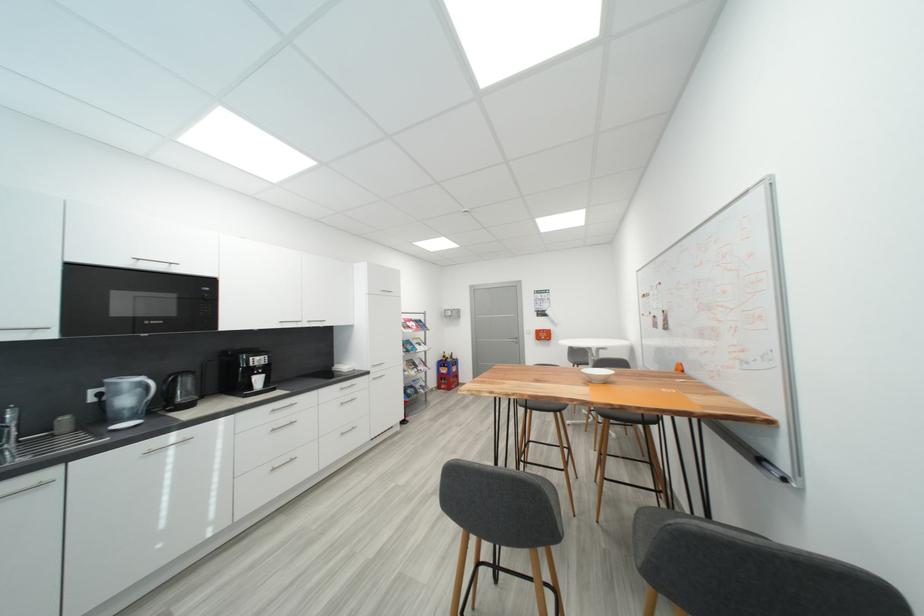
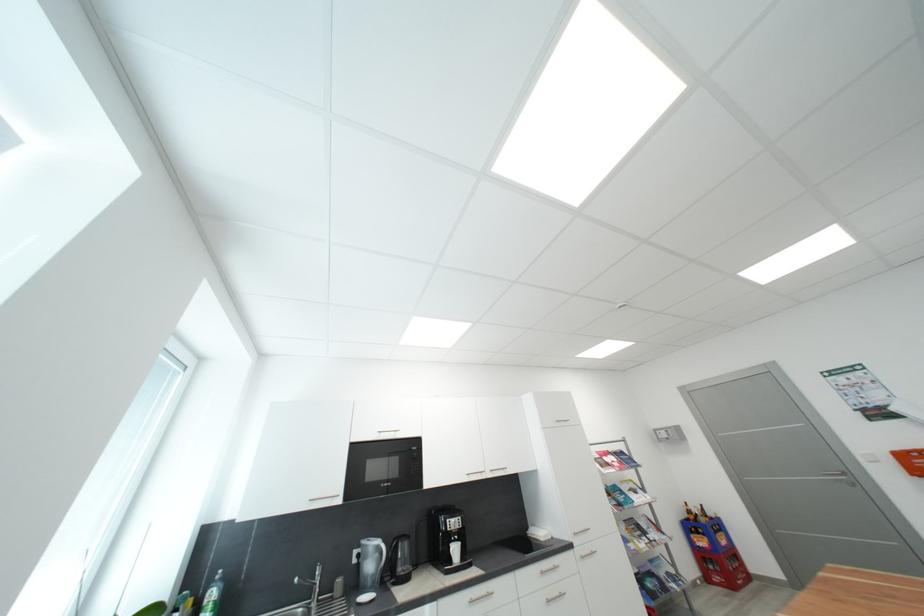
In the second image, find the point that corresponds to pixel 265 382 in the first image.

(463, 552)